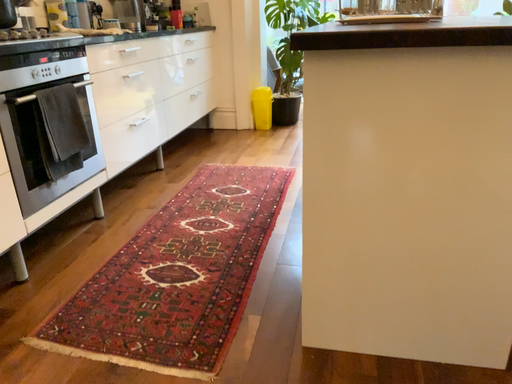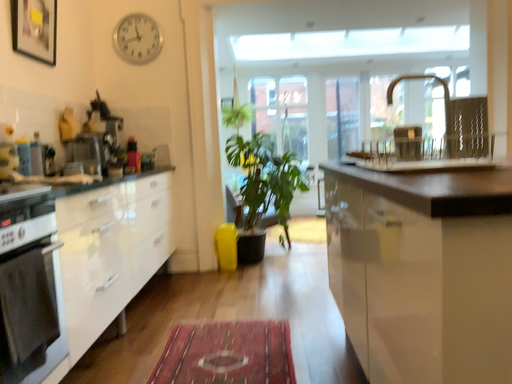
Question: How did the camera likely rotate when shooting the video?

Choices:
 (A) rotated downward
 (B) rotated upward

Answer: (B)